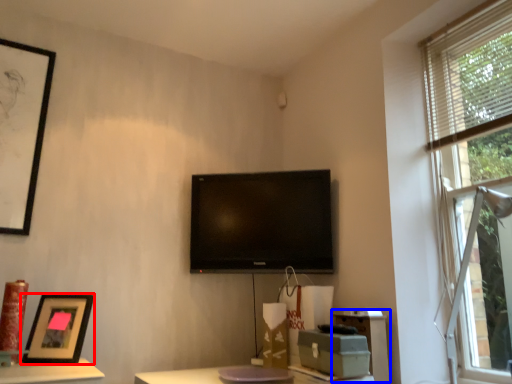
Question: Which of the following is the farthest to the observer, picture frame (highlighted by a red box) or file cabinet (highlighted by a blue box)?

Choices:
 (A) picture frame
 (B) file cabinet

Answer: (B)